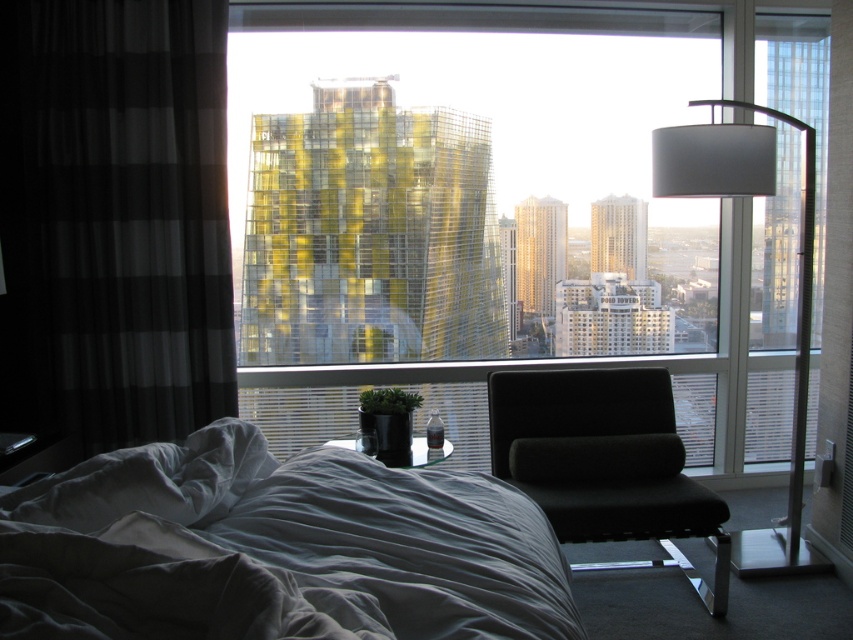
What do you see at coordinates (605, 461) in the screenshot? Image resolution: width=853 pixels, height=640 pixels. I see `black fabric swivel chair at center` at bounding box center [605, 461].

In order to click on black fabric swivel chair at center in this screenshot , I will do 605,461.

Where is `black fabric swivel chair at center`? black fabric swivel chair at center is located at coordinates (605, 461).

Which of these two, transparent glass window at center or black checkered curtain at left, stands taller?

transparent glass window at center

Does transparent glass window at center have a greater height compared to black checkered curtain at left?

Correct, transparent glass window at center is much taller as black checkered curtain at left.

Is point (241, 214) in front of point (84, 396)?

No, it is behind (84, 396).

At what (x,y) coordinates should I click in order to perform the action: click on transparent glass window at center. Please return your answer as a coordinate pair (x, y). The image size is (853, 640). Looking at the image, I should click on (508, 212).

Does black checkered curtain at left have a lesser width compared to black fabric swivel chair at center?

No, black checkered curtain at left is not thinner than black fabric swivel chair at center.

Describe the element at coordinates (114, 220) in the screenshot. I see `black checkered curtain at left` at that location.

Image resolution: width=853 pixels, height=640 pixels. What do you see at coordinates (114, 220) in the screenshot?
I see `black checkered curtain at left` at bounding box center [114, 220].

Locate an element on the screen. The width and height of the screenshot is (853, 640). black checkered curtain at left is located at coordinates (114, 220).